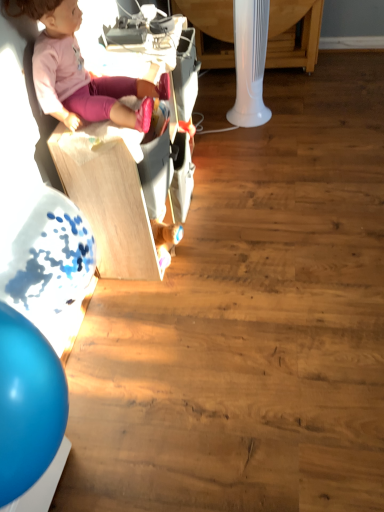
Question: Would you say pink fabric doll at upper left is part of wooden toy box at upper left's contents?

Choices:
 (A) yes
 (B) no

Answer: (B)

Question: From the image's perspective, would you say wooden toy box at upper left is shown under pink fabric doll at upper left?

Choices:
 (A) yes
 (B) no

Answer: (A)

Question: Is wooden toy box at upper left far away from pink fabric doll at upper left?

Choices:
 (A) no
 (B) yes

Answer: (A)

Question: Does wooden toy box at upper left have a smaller size compared to pink fabric doll at upper left?

Choices:
 (A) no
 (B) yes

Answer: (A)

Question: From the image's perspective, is wooden toy box at upper left located above pink fabric doll at upper left?

Choices:
 (A) no
 (B) yes

Answer: (A)

Question: Can you confirm if wooden toy box at upper left is thinner than pink fabric doll at upper left?

Choices:
 (A) yes
 (B) no

Answer: (A)

Question: Can you confirm if wooden toy box at upper left is positioned to the right of white plastic table at upper center?

Choices:
 (A) no
 (B) yes

Answer: (A)

Question: Does wooden toy box at upper left have a greater height compared to white plastic table at upper center?

Choices:
 (A) no
 (B) yes

Answer: (B)

Question: Is there a large distance between wooden toy box at upper left and white plastic table at upper center?

Choices:
 (A) yes
 (B) no

Answer: (A)

Question: Is wooden toy box at upper left smaller than white plastic table at upper center?

Choices:
 (A) no
 (B) yes

Answer: (A)

Question: Is wooden toy box at upper left not within white plastic table at upper center?

Choices:
 (A) no
 (B) yes

Answer: (B)

Question: From a real-world perspective, is wooden toy box at upper left located higher than white plastic table at upper center?

Choices:
 (A) yes
 (B) no

Answer: (A)

Question: Is white plastic table at upper center located outside wooden toy box at upper left?

Choices:
 (A) yes
 (B) no

Answer: (A)